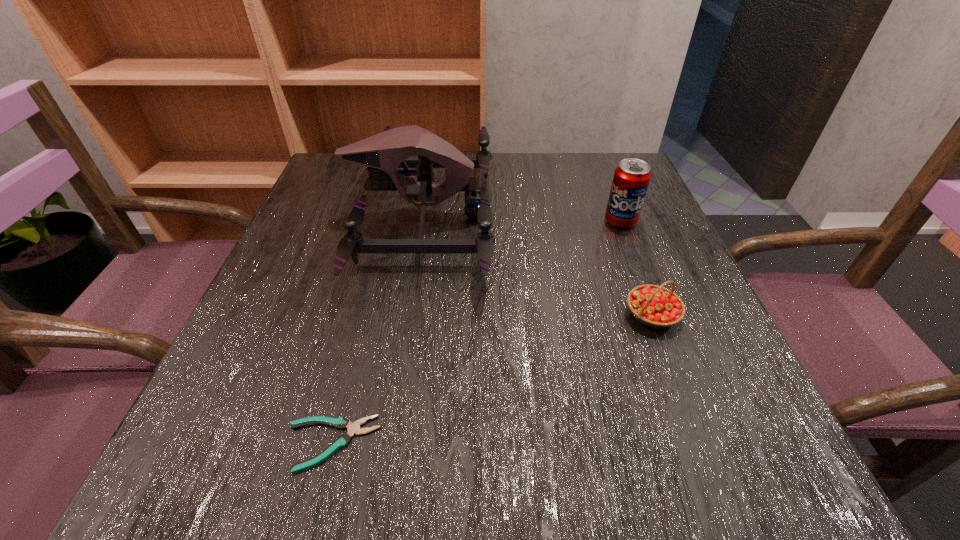
Identify the location of vacant area that satisfies the following two spatial constraints: 1. on the front-facing side of the tallest object; 2. on the back side of the strawberry. The width and height of the screenshot is (960, 540). (405, 315).

This screenshot has width=960, height=540. Identify the location of free spot that satisfies the following two spatial constraints: 1. on the back side of the nearest object; 2. on the right side of the soda can. (389, 221).

You are a GUI agent. You are given a task and a screenshot of the screen. Output one action in this format:
    pyautogui.click(x=<x>, y=<y>)
    Task: Click on the free spot that satisfies the following two spatial constraints: 1. on the back side of the strawberry; 2. on the front-facing side of the tallest object
    The width and height of the screenshot is (960, 540).
    Given the screenshot: What is the action you would take?
    pyautogui.click(x=614, y=218)

Locate an element on the screen. The width and height of the screenshot is (960, 540). free location that satisfies the following two spatial constraints: 1. on the back side of the soda can; 2. on the left side of the strawberry is located at coordinates (616, 221).

You are a GUI agent. You are given a task and a screenshot of the screen. Output one action in this format:
    pyautogui.click(x=<x>, y=<y>)
    Task: Click on the vacant area that satisfies the following two spatial constraints: 1. on the front-facing side of the third shortest object; 2. on the right side of the tallest object
    The image size is (960, 540).
    Given the screenshot: What is the action you would take?
    pyautogui.click(x=421, y=221)